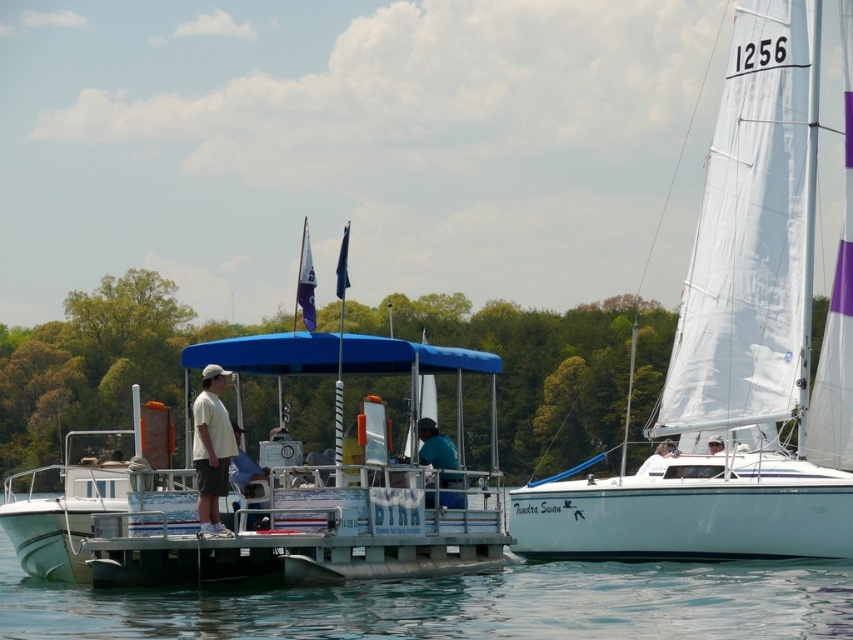
Who is lower down, transparent water at center or dark blue shirt at center?

transparent water at center

Who is positioned more to the right, transparent water at center or dark blue shirt at center?

transparent water at center

You are a GUI agent. You are given a task and a screenshot of the screen. Output one action in this format:
    pyautogui.click(x=<x>, y=<y>)
    Task: Click on the transparent water at center
    
    Given the screenshot: What is the action you would take?
    pyautogui.click(x=461, y=604)

Can you confirm if transparent water at center is positioned above white matte shirt at center?

Actually, transparent water at center is below white matte shirt at center.

Between transparent water at center and white matte shirt at center, which one has more height?

white matte shirt at center

Between point (471, 632) and point (212, 417), which one is positioned in front?

Point (471, 632) is more forward.

Find the location of `transparent water at center`. transparent water at center is located at coordinates (461, 604).

Is white sail at right wider than transparent water at center?

No, white sail at right is not wider than transparent water at center.

Can you confirm if white sail at right is positioned above transparent water at center?

Indeed, white sail at right is positioned over transparent water at center.

What do you see at coordinates (740, 339) in the screenshot?
I see `white sail at right` at bounding box center [740, 339].

This screenshot has height=640, width=853. In order to click on white sail at right in this screenshot , I will do `click(740, 339)`.